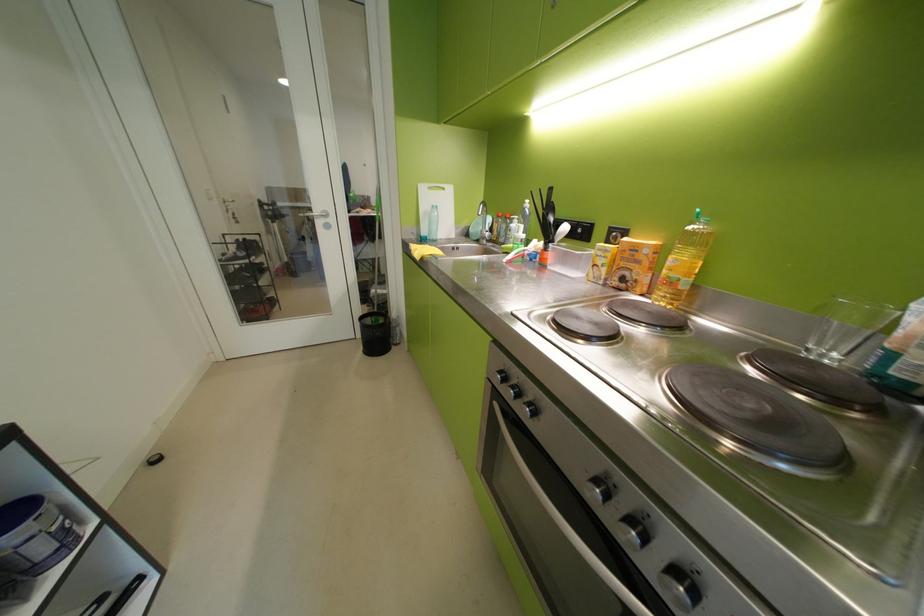
Find the location of `silver oven handle`. silver oven handle is located at coordinates (566, 524).